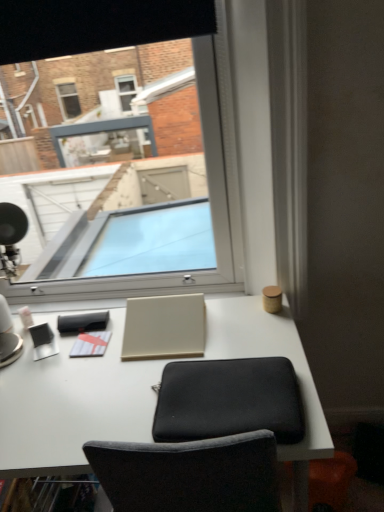
Question: Should I look upward or downward to see matte white notepad at center, marked as the 2th notepad in a front-to-back arrangement?

Choices:
 (A) up
 (B) down

Answer: (B)

Question: From a real-world perspective, is white matte notepad at center, which ranks as the 1th notepad in bottom-to-top order, under transparent glass window at center?

Choices:
 (A) no
 (B) yes

Answer: (B)

Question: Is white matte notepad at center, which ranks as the 1th notepad in bottom-to-top order, to the left of transparent glass window at center from the viewer's perspective?

Choices:
 (A) no
 (B) yes

Answer: (B)

Question: From a real-world perspective, does white matte notepad at center, positioned as the 1th notepad in front-to-back order, stand above transparent glass window at center?

Choices:
 (A) yes
 (B) no

Answer: (B)

Question: Is the position of white matte notepad at center, which ranks as the 1th notepad in bottom-to-top order, less distant than that of transparent glass window at center?

Choices:
 (A) yes
 (B) no

Answer: (B)

Question: From the image's perspective, does white matte notepad at center, which ranks as the 2th notepad in top-to-bottom order, appear higher than transparent glass window at center?

Choices:
 (A) yes
 (B) no

Answer: (B)

Question: Is white matte notepad at center, which is counted as the 2th notepad, starting from the back, at the right side of transparent glass window at center?

Choices:
 (A) yes
 (B) no

Answer: (B)

Question: Can you confirm if white matte desk at center is wider than beige matte laptop at center?

Choices:
 (A) yes
 (B) no

Answer: (A)

Question: From a real-world perspective, is white matte desk at center over beige matte laptop at center?

Choices:
 (A) yes
 (B) no

Answer: (B)

Question: Is white matte desk at center smaller than beige matte laptop at center?

Choices:
 (A) yes
 (B) no

Answer: (B)

Question: Is white matte desk at center positioned in front of beige matte laptop at center?

Choices:
 (A) yes
 (B) no

Answer: (A)

Question: From the image's perspective, is white matte desk at center located beneath beige matte laptop at center?

Choices:
 (A) no
 (B) yes

Answer: (B)

Question: Is white matte desk at center to the right of beige matte laptop at center from the viewer's perspective?

Choices:
 (A) yes
 (B) no

Answer: (A)

Question: Is beige matte laptop at center positioned with its back to black fabric computer chair at center?

Choices:
 (A) yes
 (B) no

Answer: (B)